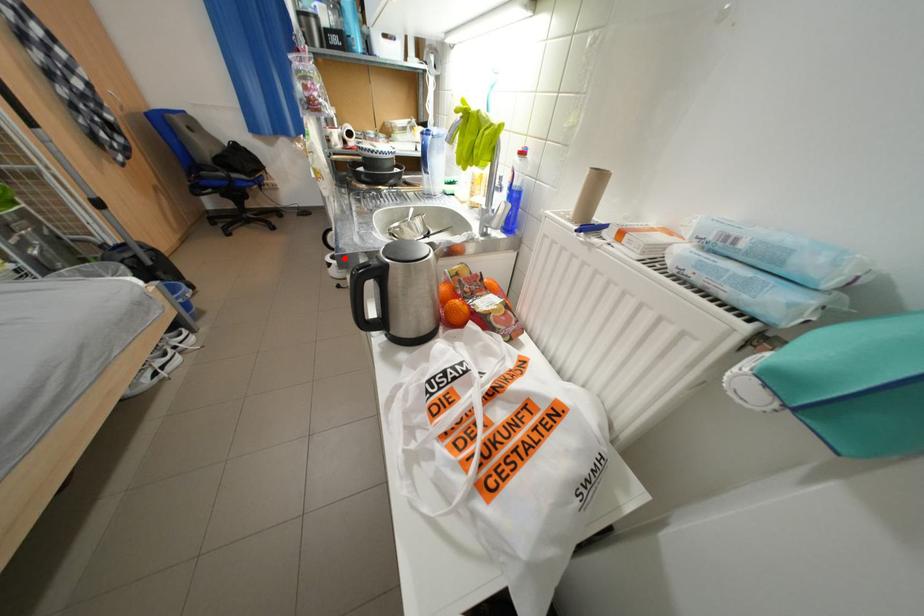
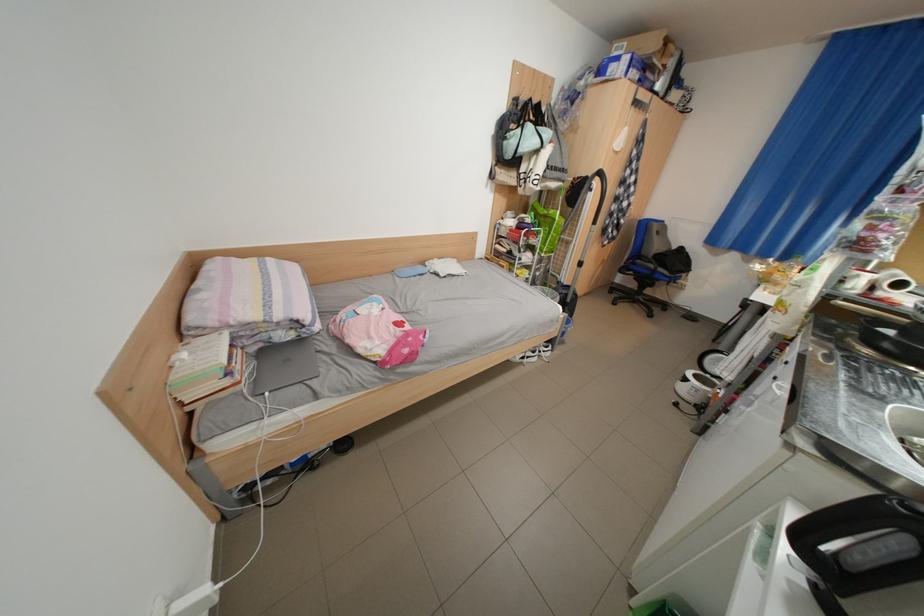
Question: I am providing you with two images of the same scene from different viewpoints. A red point is shown in image1. For the corresponding object point in image2, is it positioned nearer or farther from the camera?

Choices:
 (A) Nearer
 (B) Farther

Answer: (A)